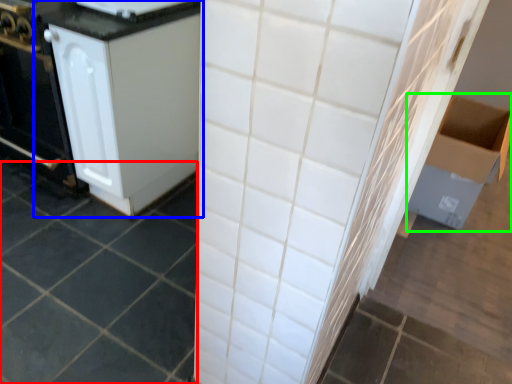
Question: Considering the real-world distances, which object is farthest from ceramic tile (highlighted by a red box)? cabinetry (highlighted by a blue box) or cardboard box (highlighted by a green box)?

Choices:
 (A) cabinetry
 (B) cardboard box

Answer: (B)